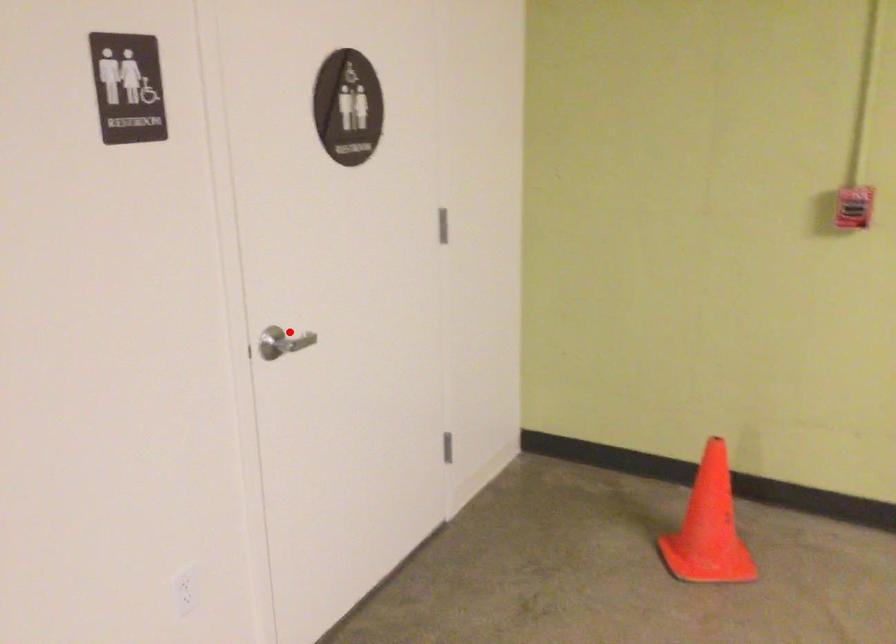
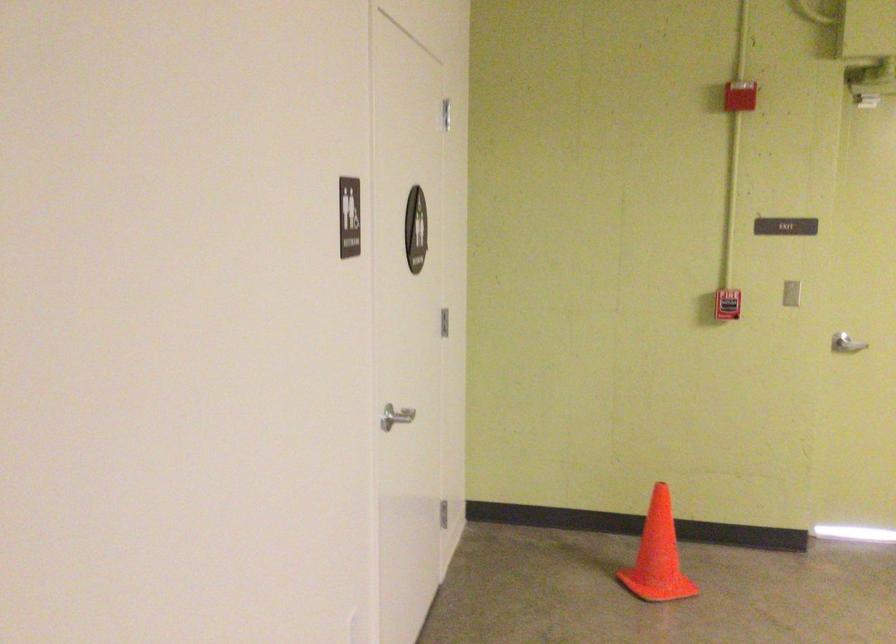
Question: A red point is marked in image1. In image2, is the corresponding 3D point closer to the camera or farther? Reply with the corresponding letter.

Choices:
 (A) The corresponding 3D point is closer.
 (B) The corresponding 3D point is farther.

Answer: (B)